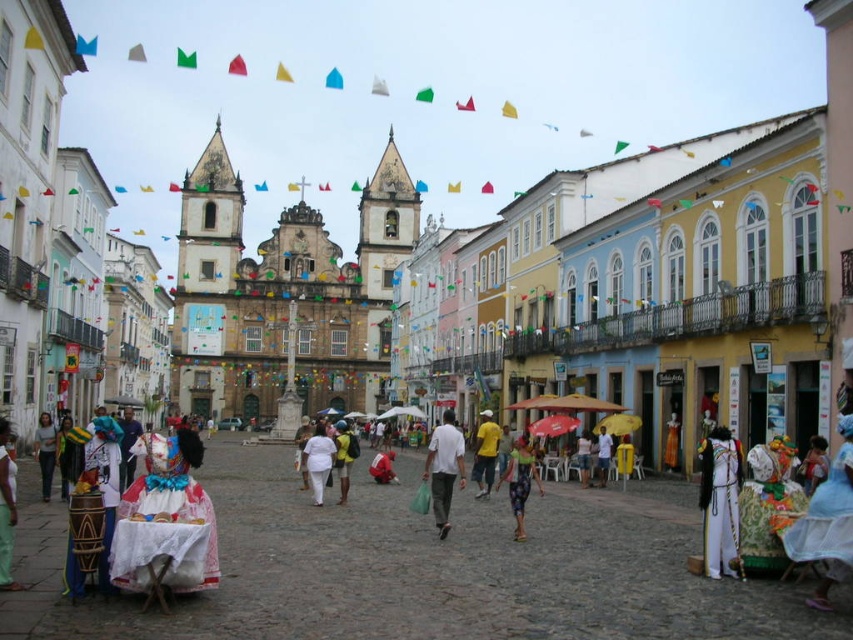
Can you confirm if white cotton dress at center is bigger than yellow matte shirt at center?

Indeed, white cotton dress at center has a larger size compared to yellow matte shirt at center.

Identify the location of white cotton dress at center. The height and width of the screenshot is (640, 853). (318, 460).

Between point (520, 509) and point (320, 444), which one is positioned in front?

Point (520, 509) is more forward.

Is point (502, 472) behind point (322, 420)?

No, it is not.

Which is in front, point (509, 484) or point (318, 490)?

Point (509, 484) is more forward.

This screenshot has width=853, height=640. I want to click on multicolored fabric dress at center, so click(x=519, y=481).

Which is in front, point (524, 456) or point (488, 492)?

Point (524, 456) is in front.

Is point (527, 474) in front of point (479, 464)?

Yes, it is.

Where is `multicolored fabric dress at center`? multicolored fabric dress at center is located at coordinates (519, 481).